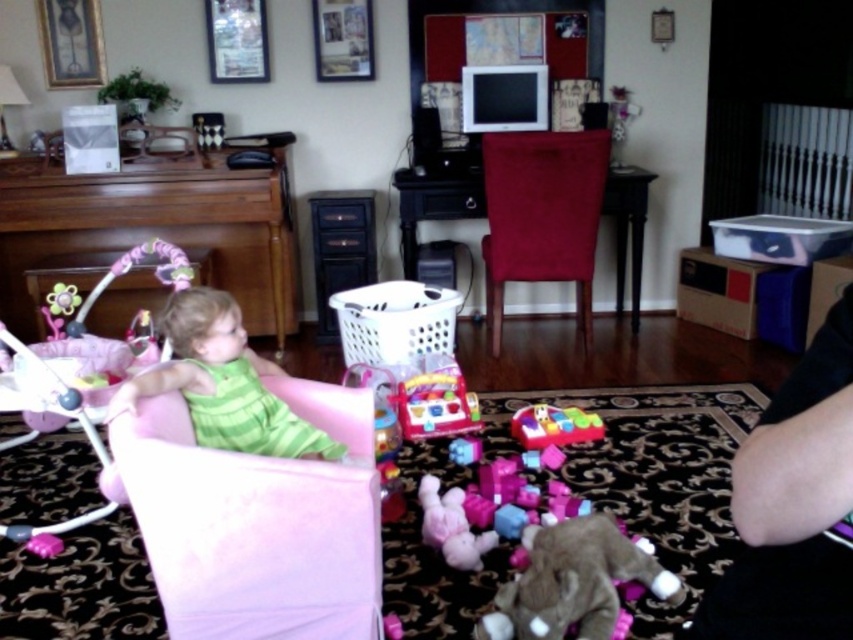
How far apart are soft plush elephant at lower center and plastic colorful car at center?

A distance of 38.17 inches exists between soft plush elephant at lower center and plastic colorful car at center.

Between soft plush elephant at lower center and plastic colorful car at center, which one appears on the left side from the viewer's perspective?

From the viewer's perspective, plastic colorful car at center appears more on the left side.

Find the location of a particular element. This screenshot has height=640, width=853. soft plush elephant at lower center is located at coordinates (573, 580).

Locate an element on the screen. The height and width of the screenshot is (640, 853). suede-like burgundy chair at center is located at coordinates (541, 214).

This screenshot has height=640, width=853. What do you see at coordinates (541, 214) in the screenshot?
I see `suede-like burgundy chair at center` at bounding box center [541, 214].

Identify the location of suede-like burgundy chair at center. This screenshot has width=853, height=640. (541, 214).

How far apart are suede-like burgundy chair at center and soft plush elephant at lower center?

suede-like burgundy chair at center is 6.06 feet from soft plush elephant at lower center.

Does suede-like burgundy chair at center have a greater height compared to soft plush elephant at lower center?

Indeed, suede-like burgundy chair at center has a greater height compared to soft plush elephant at lower center.

What do you see at coordinates (541, 214) in the screenshot? The width and height of the screenshot is (853, 640). I see `suede-like burgundy chair at center` at bounding box center [541, 214].

The image size is (853, 640). Identify the location of suede-like burgundy chair at center. (541, 214).